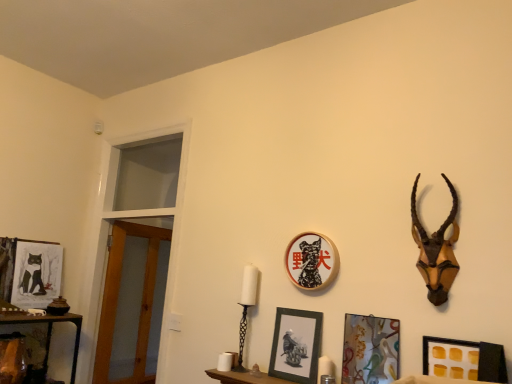
Question: From a real-world perspective, is matte black picture frame at center, which is the 3th picture frame from right to left, above or below matte wood shelf at lower center?

Choices:
 (A) below
 (B) above

Answer: (B)

Question: Is matte black picture frame at center, the fourth picture frame when ordered from front to back, spatially inside matte wood shelf at lower center, or outside of it?

Choices:
 (A) inside
 (B) outside

Answer: (B)

Question: Estimate the real-world distances between objects in this image. Which object is farther from the matte wood shelf at lower center?

Choices:
 (A) brown wooden antelope head at upper right
 (B) metallic glass picture frame at lower right, which is the 4th picture frame in back-to-front order
 (C) matte black picture frame at left, marked as the fifth picture frame in a front-to-back arrangement
 (D) black matte picture frame at lower right, which is the fifth picture frame in back-to-front order
 (E) matte black picture frame at center, placed as the second picture frame when sorted from left to right

Answer: (C)

Question: Considering the real-world distances, which object is closest to the metallic glass picture frame at lower right, which appears as the 4th picture frame when viewed from the left?

Choices:
 (A) matte wood shelf at lower center
 (B) matte black picture frame at left, which is the fifth picture frame from right to left
 (C) brown wooden antelope head at upper right
 (D) matte black picture frame at center, which is the 3th picture frame from right to left
 (E) black matte picture frame at lower right, the first picture frame positioned from the front

Answer: (E)